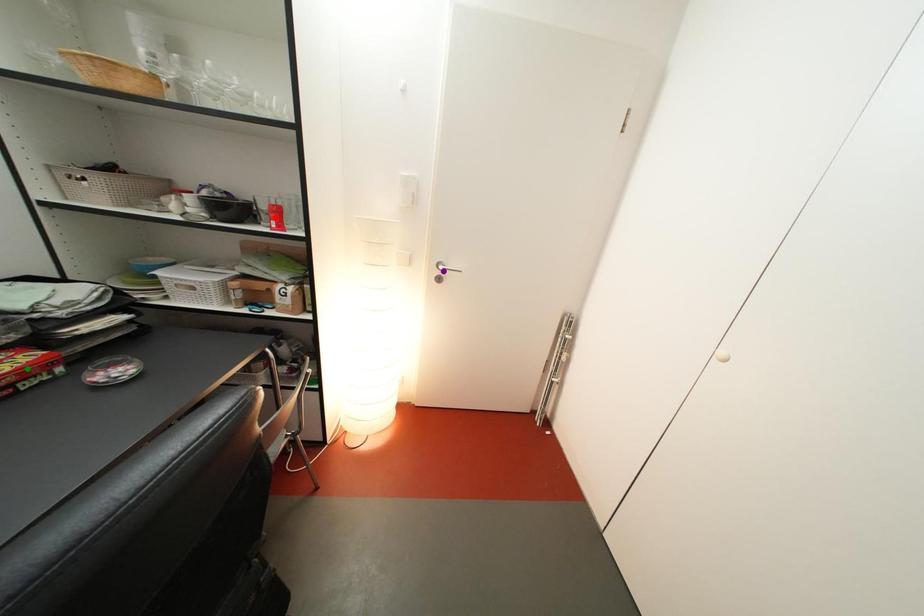
Order these from nearest to farthest:
1. green point
2. purple point
3. red point

green point, red point, purple point